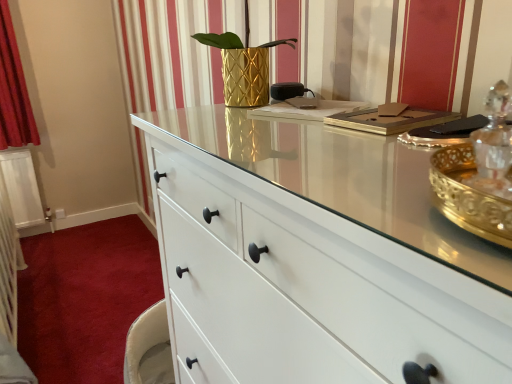
Question: Looking at the image, does white matte drawer at lower left seem bigger or smaller compared to gold textured vase at center?

Choices:
 (A) small
 (B) big

Answer: (B)

Question: Is white matte drawer at lower left wider or thinner than gold textured vase at center?

Choices:
 (A) wide
 (B) thin

Answer: (A)

Question: Is white matte drawer at lower left situated inside gold textured vase at center or outside?

Choices:
 (A) outside
 (B) inside

Answer: (A)

Question: Is point (232, 92) closer or farther from the camera than point (120, 271)?

Choices:
 (A) closer
 (B) farther

Answer: (A)

Question: Considering the relative positions of gold textured vase at center and white matte drawer at lower left in the image provided, is gold textured vase at center to the left or to the right of white matte drawer at lower left?

Choices:
 (A) left
 (B) right

Answer: (B)

Question: From a real-world perspective, is gold textured vase at center above or below white matte drawer at lower left?

Choices:
 (A) above
 (B) below

Answer: (A)

Question: Is gold textured vase at center taller or shorter than white matte drawer at lower left?

Choices:
 (A) short
 (B) tall

Answer: (B)